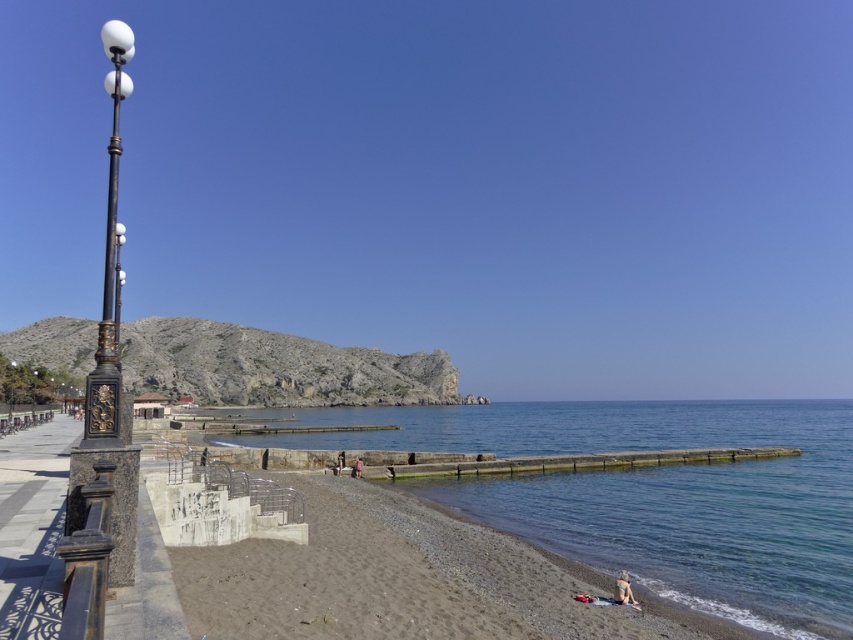
You are standing at the point labeled point (842, 573) and want to reach the water edge. The distance between you and the water edge is 72.55 feet. Can you walk directly to the water without any obstacles?

The distance between point (842, 573) and the viewer is 72.55 feet, so yes, you can walk directly to the water edge as there are no obstacles mentioned in the scene description.

You are a photographer positioned at the origin point of the image. You need to place a camera on the beige fabric towel at lower right. What are the coordinates where you should position the camera?

The beige fabric towel at lower right is located at coordinates point (x=624, y=589). Position the camera there.